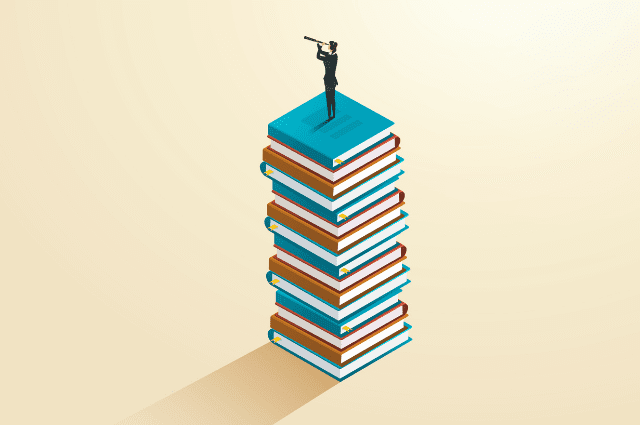
In order to click on red cover book in this screenshot , I will do `click(404, 309)`, `click(401, 250)`, `click(399, 195)`, `click(395, 136)`.